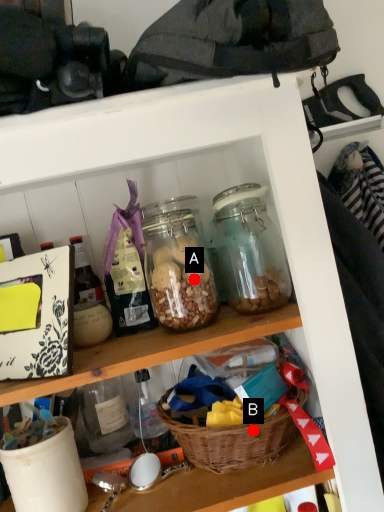
Question: Two points are circled on the image, labeled by A and B beside each circle. Which of the following is the farthest from the observer?

Choices:
 (A) A is further
 (B) B is further

Answer: (A)